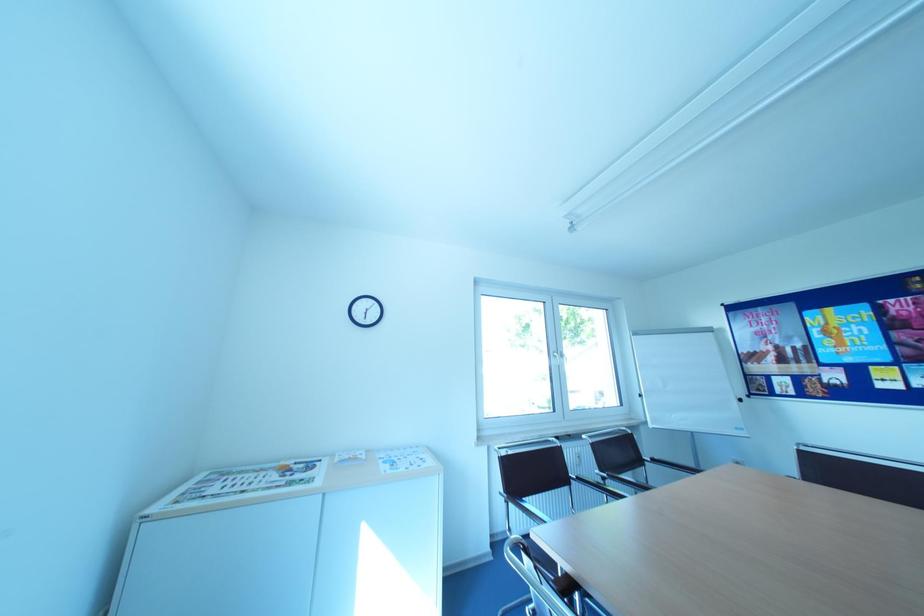
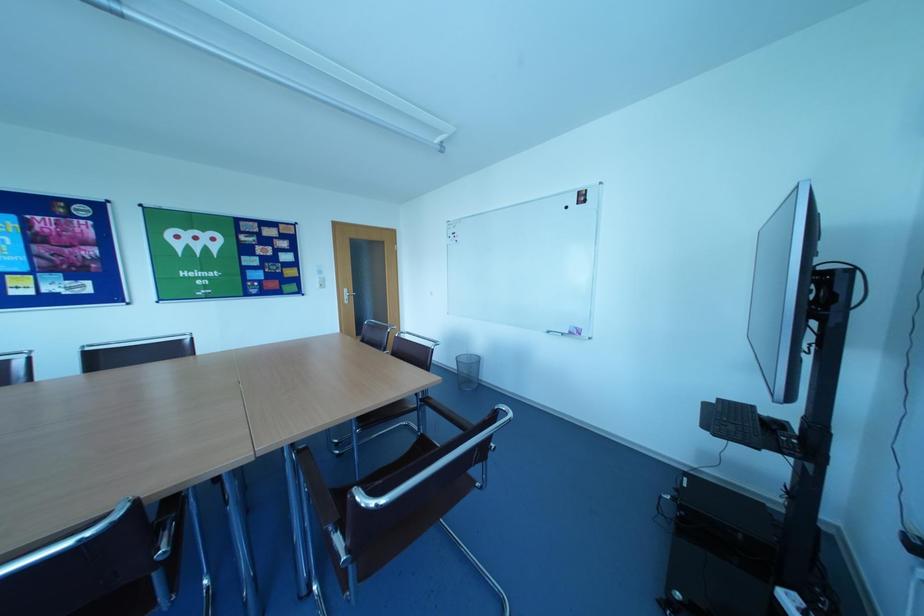
Question: The camera is either moving clockwise (left) or counter-clockwise (right) around the object. The first image is from the beginning of the video and the second image is from the end. Is the camera moving left or right when shooting the video?

Choices:
 (A) Left
 (B) Right

Answer: (A)